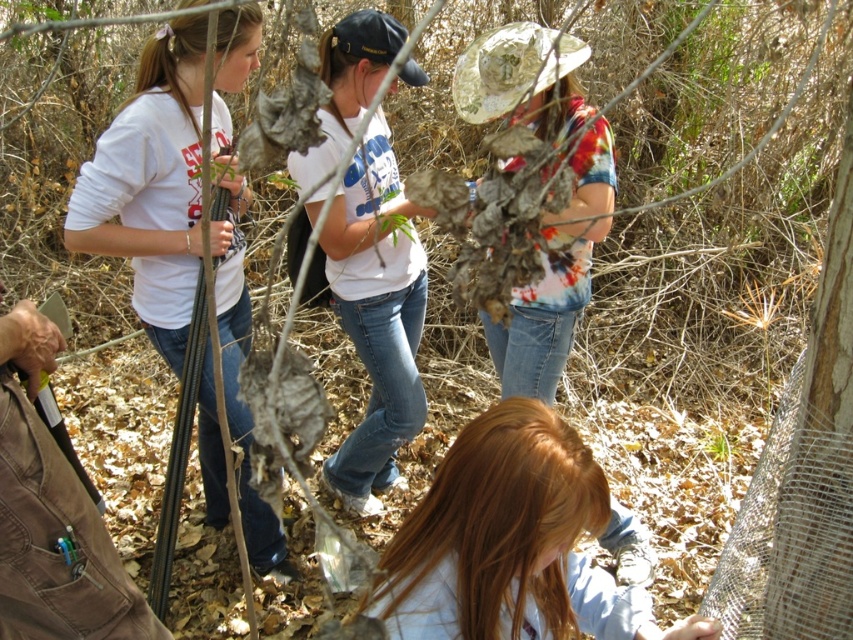
Question: Is white matte shirt at left smaller than white cotton t-shirt at center?

Choices:
 (A) yes
 (B) no

Answer: (B)

Question: Among these points, which one is nearest to the camera?

Choices:
 (A) (405, 36)
 (B) (485, 545)
 (C) (103, 154)
 (D) (512, 68)

Answer: (B)

Question: Does white matte shirt at left appear on the left side of printed cotton shirt at center?

Choices:
 (A) yes
 (B) no

Answer: (A)

Question: Can you confirm if light brown hair at lower center is thinner than white cotton t-shirt at center?

Choices:
 (A) yes
 (B) no

Answer: (B)

Question: Which of the following is the farthest from the observer?

Choices:
 (A) printed cotton shirt at center
 (B) white cotton t-shirt at center
 (C) white matte shirt at left
 (D) light brown hair at lower center

Answer: (B)

Question: Which point is closer to the camera?

Choices:
 (A) printed cotton shirt at center
 (B) white matte shirt at left
 (C) light brown hair at lower center

Answer: (A)